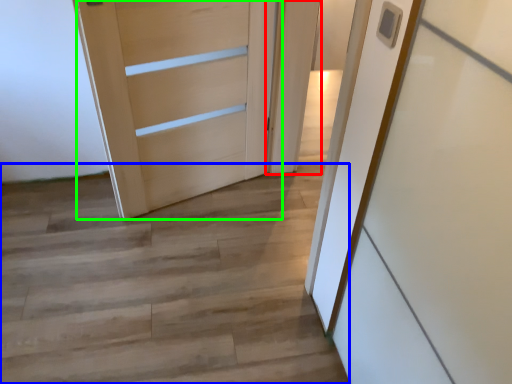
Question: Based on their relative distances, which object is nearer to door (highlighted by a red box)? Choose from stairwell (highlighted by a blue box) and door (highlighted by a green box).

Choices:
 (A) stairwell
 (B) door

Answer: (B)